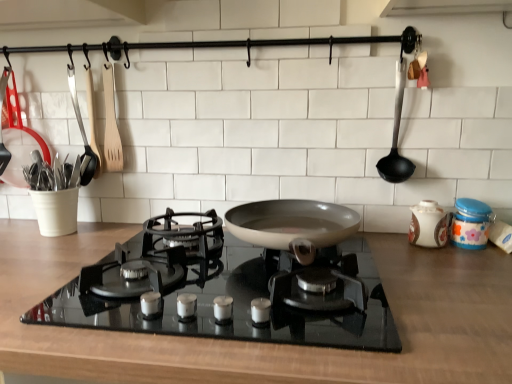
What are the coordinates of `vacant space to the right of black glass gas stove at center` in the screenshot? It's located at (435, 281).